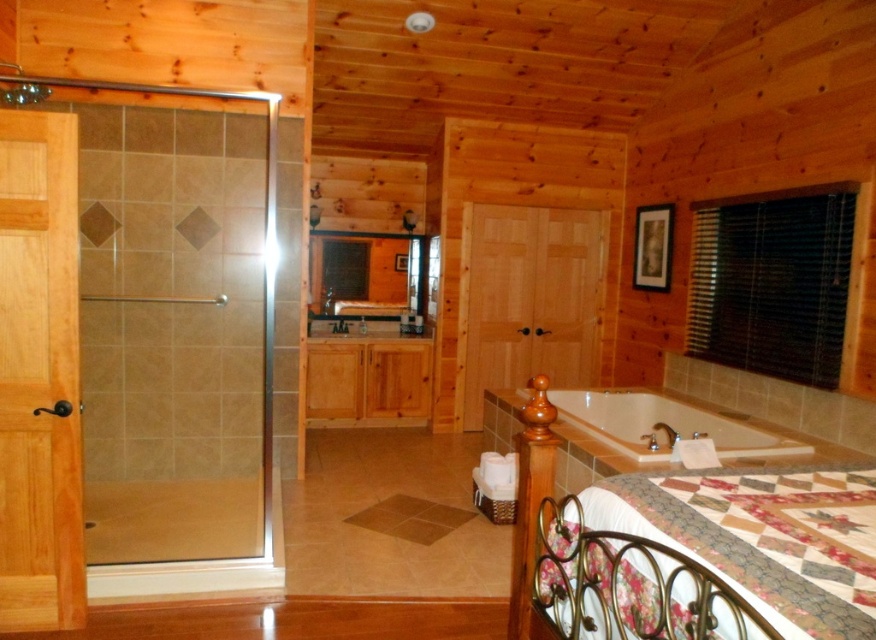
Which is in front, point (658, 552) or point (485, 381)?

Positioned in front is point (658, 552).

Who is more forward, (677,621) or (509,241)?

Point (677,621) is more forward.

Locate an element on the screen. floral patchwork quilt at lower right is located at coordinates (701, 563).

Which of these two, clear glass door at left or white glossy bathtub at lower right, stands taller?

Standing taller between the two is clear glass door at left.

Which is more to the right, clear glass door at left or white glossy bathtub at lower right?

Positioned to the right is white glossy bathtub at lower right.

Between point (2, 561) and point (657, 460), which one is positioned behind?

Point (657, 460)

Find the location of `clear glass door at left`. clear glass door at left is located at coordinates (39, 376).

Measure the distance between floral patchwork quilt at lower right and camera.

A distance of 4.11 feet exists between floral patchwork quilt at lower right and camera.

Is floral patchwork quilt at lower right smaller than clear glass door at left?

Actually, floral patchwork quilt at lower right might be larger than clear glass door at left.

Does point (563, 586) come in front of point (72, 296)?

Yes, point (563, 586) is closer to viewer.

At what (x,y) coordinates should I click in order to perform the action: click on floral patchwork quilt at lower right. Please return your answer as a coordinate pair (x, y). This screenshot has width=876, height=640. Looking at the image, I should click on (701, 563).